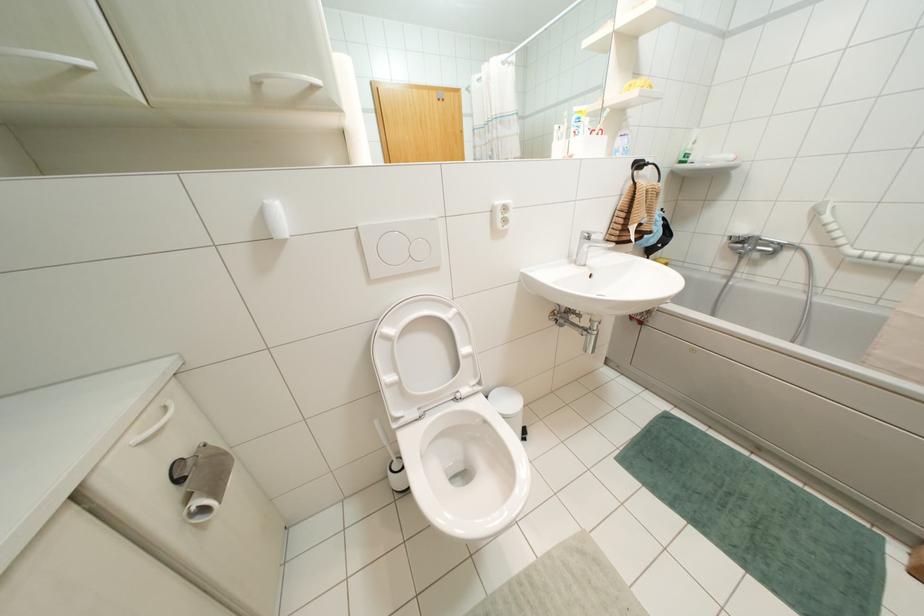
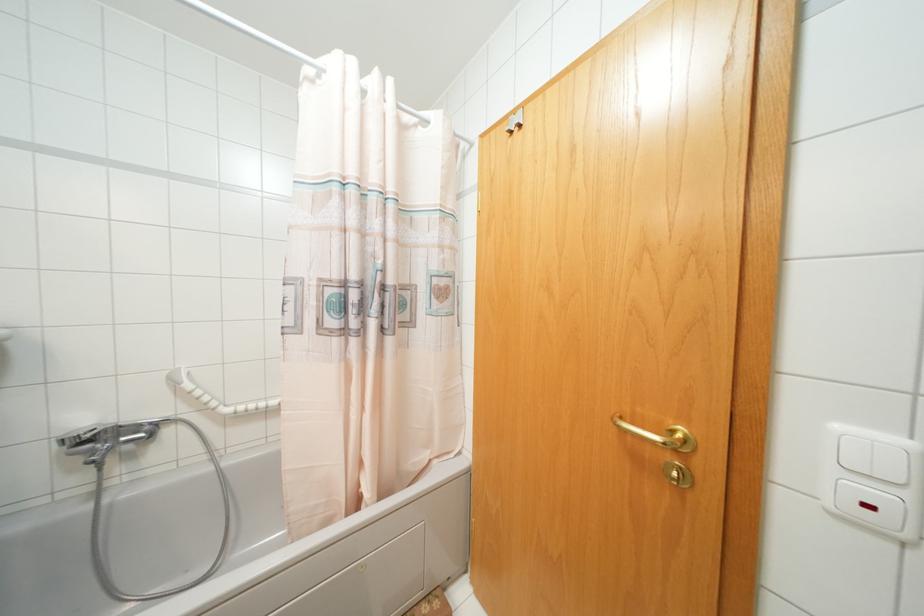
Question: The first image is from the beginning of the video and the second image is from the end. How did the camera likely rotate when shooting the video?

Choices:
 (A) Left
 (B) Right
 (C) Up
 (D) Down

Answer: (B)